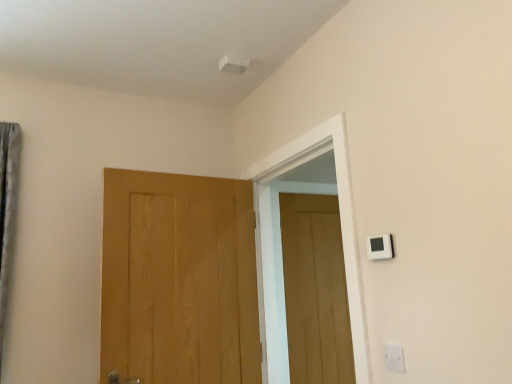
Question: Is white plastic electric outlet at lower right shorter than wooden door at center, which is the second door from left to right?

Choices:
 (A) no
 (B) yes

Answer: (B)

Question: Does white plastic electric outlet at lower right lie in front of wooden door at center, the second door in the front-to-back sequence?

Choices:
 (A) no
 (B) yes

Answer: (B)

Question: Is white plastic electric outlet at lower right thinner than wooden door at center, the second door in the front-to-back sequence?

Choices:
 (A) no
 (B) yes

Answer: (B)

Question: From the image's perspective, is white plastic electric outlet at lower right on wooden door at center, the second door in the front-to-back sequence?

Choices:
 (A) no
 (B) yes

Answer: (B)

Question: Is white plastic electric outlet at lower right oriented away from wooden door at center, the 1th door in the right-to-left sequence?

Choices:
 (A) yes
 (B) no

Answer: (B)

Question: From a real-world perspective, is white plastic electric outlet at lower right positioned under wooden door at center, the second door in the front-to-back sequence, based on gravity?

Choices:
 (A) no
 (B) yes

Answer: (B)

Question: Does white plastic light switch at upper right have a greater height compared to white plastic electric outlet at lower right?

Choices:
 (A) yes
 (B) no

Answer: (B)

Question: Is white plastic light switch at upper right to the left of white plastic electric outlet at lower right from the viewer's perspective?

Choices:
 (A) no
 (B) yes

Answer: (B)

Question: Is white plastic light switch at upper right looking in the opposite direction of white plastic electric outlet at lower right?

Choices:
 (A) yes
 (B) no

Answer: (B)

Question: From the image's perspective, is white plastic light switch at upper right above white plastic electric outlet at lower right?

Choices:
 (A) no
 (B) yes

Answer: (B)

Question: From a real-world perspective, is white plastic light switch at upper right under white plastic electric outlet at lower right?

Choices:
 (A) yes
 (B) no

Answer: (B)

Question: From a real-world perspective, does white plastic light switch at upper right stand above white plastic electric outlet at lower right?

Choices:
 (A) no
 (B) yes

Answer: (B)

Question: Can you confirm if white plastic light switch at upper right is smaller than light brown wood door at center, which appears as the first door when viewed from the left?

Choices:
 (A) no
 (B) yes

Answer: (B)